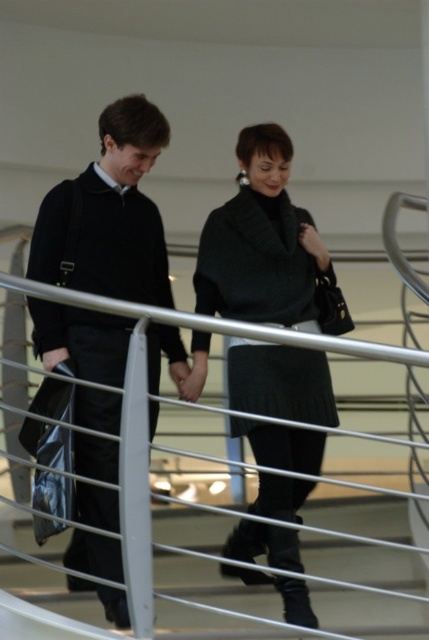
Is matte black sweater at center further to camera compared to white metal railing at center?

Yes, it is.

Does matte black sweater at center have a greater height compared to white metal railing at center?

Yes, matte black sweater at center is taller than white metal railing at center.

The height and width of the screenshot is (640, 429). Identify the location of matte black sweater at center. (266, 248).

Which is below, knitted black dress at center or white metal railing at center?

white metal railing at center

Does point (250, 236) come behind point (27, 637)?

That is True.

Where is `knitted black dress at center`? Image resolution: width=429 pixels, height=640 pixels. knitted black dress at center is located at coordinates (257, 262).

The image size is (429, 640). Identify the location of knitted black dress at center. (257, 262).

Can you confirm if matte black sweater at center is bigger than matte black coat at left?

Correct, matte black sweater at center is larger in size than matte black coat at left.

Between matte black sweater at center and matte black coat at left, which one is positioned lower?

matte black sweater at center is below.

Does point (332, 326) come farther from viewer compared to point (142, 243)?

Yes, it is.

Identify the location of matte black sweater at center. (266, 248).